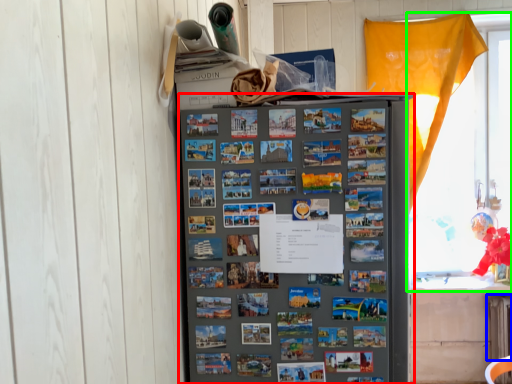
Question: Which object is positioned farthest from refrigerator (highlighted by a red box)? Select from radiator (highlighted by a blue box) and window (highlighted by a green box).

Choices:
 (A) radiator
 (B) window

Answer: (A)